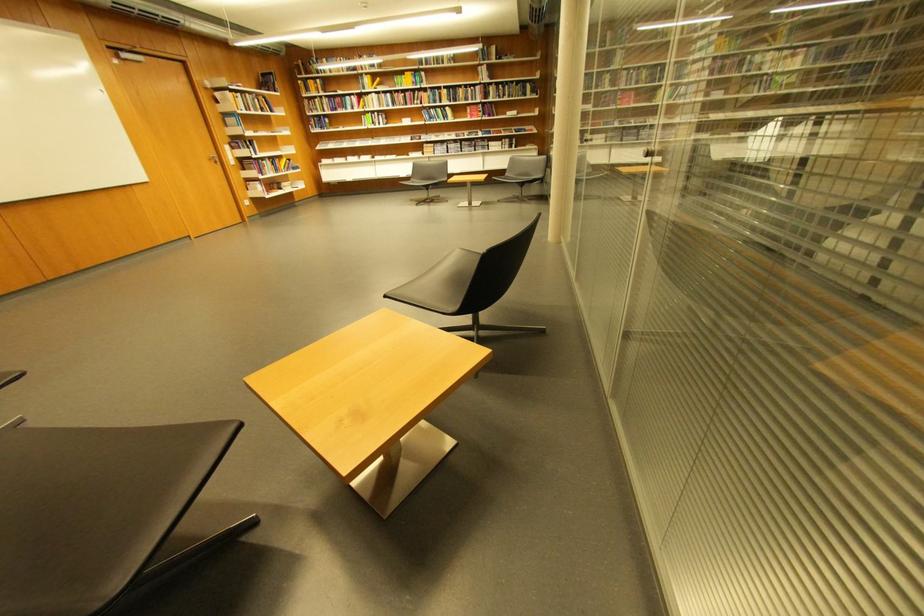
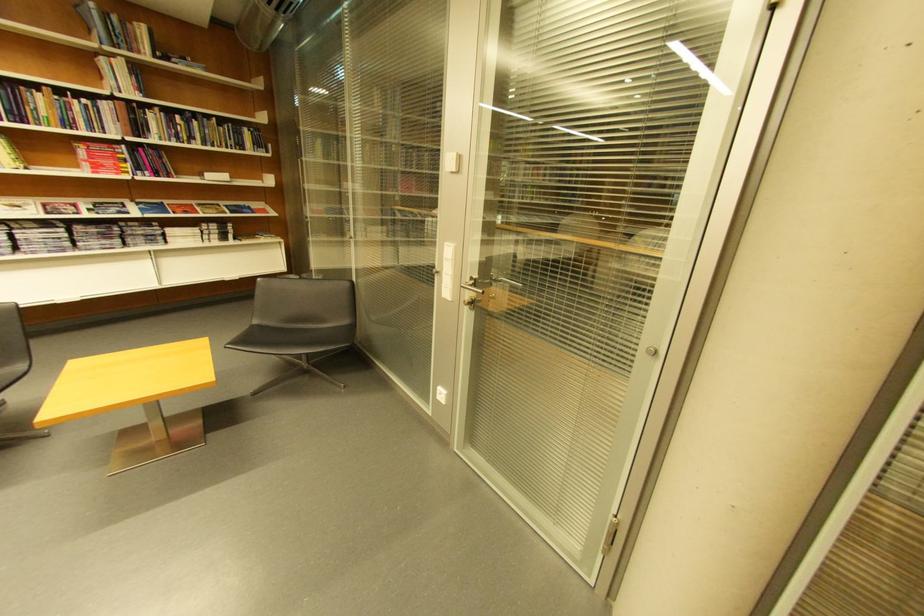
Where in the second image is the point corresponding to point (517, 89) from the first image?

(205, 124)